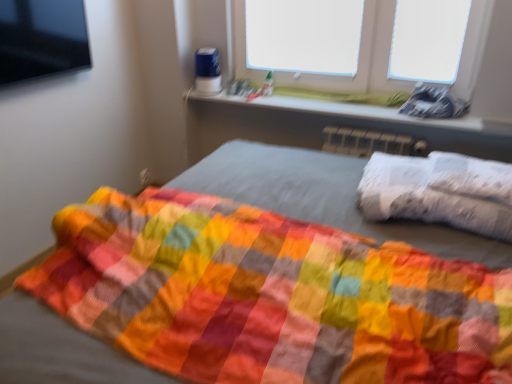
Question: Is white matte window screen at upper center, the first window screen when ordered from left to right, at the left side of transparent plastic at upper right, arranged as the 2th window screen when viewed from the left?

Choices:
 (A) yes
 (B) no

Answer: (A)

Question: Is white matte window screen at upper center, the first window screen when ordered from left to right, beside transparent plastic at upper right, arranged as the 2th window screen when viewed from the left?

Choices:
 (A) yes
 (B) no

Answer: (B)

Question: Considering the relative sizes of white matte window screen at upper center, the second window screen viewed from the right, and transparent plastic at upper right, arranged as the 2th window screen when viewed from the left, in the image provided, is white matte window screen at upper center, the second window screen viewed from the right, bigger than transparent plastic at upper right, arranged as the 2th window screen when viewed from the left,?

Choices:
 (A) no
 (B) yes

Answer: (B)

Question: Is transparent plastic at upper right, the 1th window screen positioned from the right, located within white matte window screen at upper center, the second window screen viewed from the right?

Choices:
 (A) yes
 (B) no

Answer: (B)

Question: Does white matte window screen at upper center, the second window screen viewed from the right, have a greater width compared to transparent plastic at upper right, arranged as the 2th window screen when viewed from the left?

Choices:
 (A) yes
 (B) no

Answer: (A)

Question: Based on their sizes in the image, would you say white plastic window sill at upper center is bigger or smaller than transparent plastic at upper right, the 1th window screen positioned from the right?

Choices:
 (A) small
 (B) big

Answer: (B)

Question: In the image, is white plastic window sill at upper center on the left side or the right side of transparent plastic at upper right, the 1th window screen positioned from the right?

Choices:
 (A) left
 (B) right

Answer: (A)

Question: Does point pyautogui.click(x=373, y=109) appear closer or farther from the camera than point pyautogui.click(x=434, y=13)?

Choices:
 (A) closer
 (B) farther

Answer: (B)

Question: From the image's perspective, is white plastic window sill at upper center positioned above or below transparent plastic at upper right, the 1th window screen positioned from the right?

Choices:
 (A) above
 (B) below

Answer: (B)

Question: Considering the positions of white textured pillow at right and transparent plastic at upper right, arranged as the 2th window screen when viewed from the left, in the image, is white textured pillow at right wider or thinner than transparent plastic at upper right, arranged as the 2th window screen when viewed from the left,?

Choices:
 (A) wide
 (B) thin

Answer: (A)

Question: In the image, is white textured pillow at right on the left side or the right side of transparent plastic at upper right, arranged as the 2th window screen when viewed from the left?

Choices:
 (A) right
 (B) left

Answer: (B)

Question: Is point (486, 230) closer or farther from the camera than point (393, 54)?

Choices:
 (A) closer
 (B) farther

Answer: (A)

Question: Is white textured pillow at right spatially inside transparent plastic at upper right, arranged as the 2th window screen when viewed from the left, or outside of it?

Choices:
 (A) outside
 (B) inside

Answer: (A)

Question: Is white matte window screen at upper center, the second window screen viewed from the right, bigger or smaller than white plastic window sill at upper center?

Choices:
 (A) big
 (B) small

Answer: (B)

Question: Would you say white matte window screen at upper center, the second window screen viewed from the right, is to the left or to the right of white plastic window sill at upper center in the picture?

Choices:
 (A) right
 (B) left

Answer: (B)